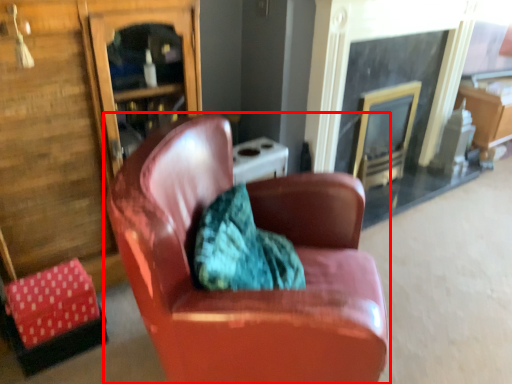
Question: From the image's perspective, what is the correct spatial positioning of chair (annotated by the red box) in reference to fireplace?

Choices:
 (A) below
 (B) above

Answer: (A)